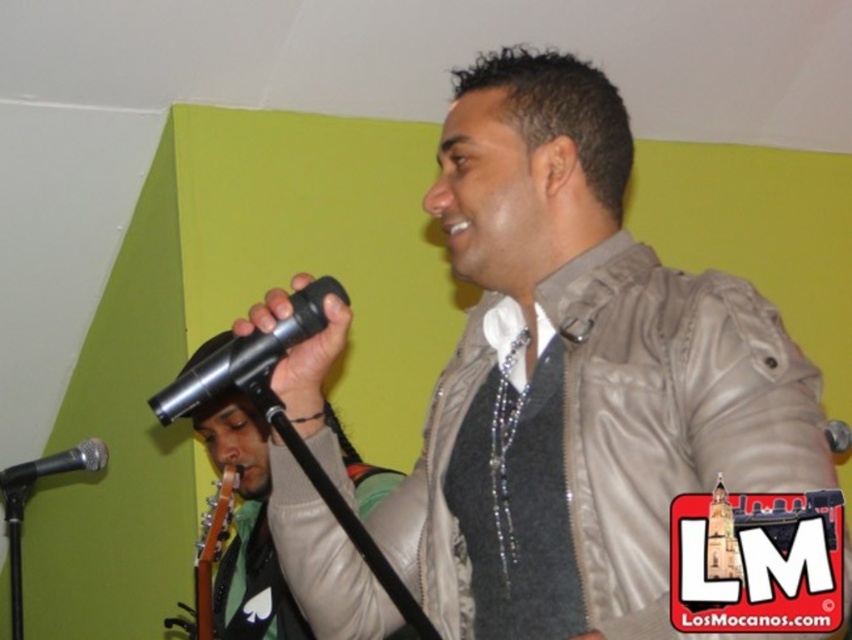
Question: Can you confirm if matte beige jacket at center is positioned below shiny metallic microphone at center?

Choices:
 (A) no
 (B) yes

Answer: (A)

Question: Does matte beige jacket at center appear on the right side of metallic silver microphone at left?

Choices:
 (A) yes
 (B) no

Answer: (A)

Question: Estimate the real-world distances between objects in this image. Which object is farther from the metallic silver microphone at left?

Choices:
 (A) shiny metallic microphone at center
 (B) matte beige jacket at center

Answer: (B)

Question: Among these objects, which one is farthest from the camera?

Choices:
 (A) green matte sweater at center
 (B) shiny metallic microphone at center
 (C) matte beige jacket at center
 (D) metallic silver microphone at left

Answer: (D)

Question: Which point is closer to the camera?

Choices:
 (A) metallic silver microphone at left
 (B) shiny metallic microphone at center
 (C) matte beige jacket at center

Answer: (C)

Question: Is green matte sweater at center to the right of shiny metallic microphone at center from the viewer's perspective?

Choices:
 (A) no
 (B) yes

Answer: (A)